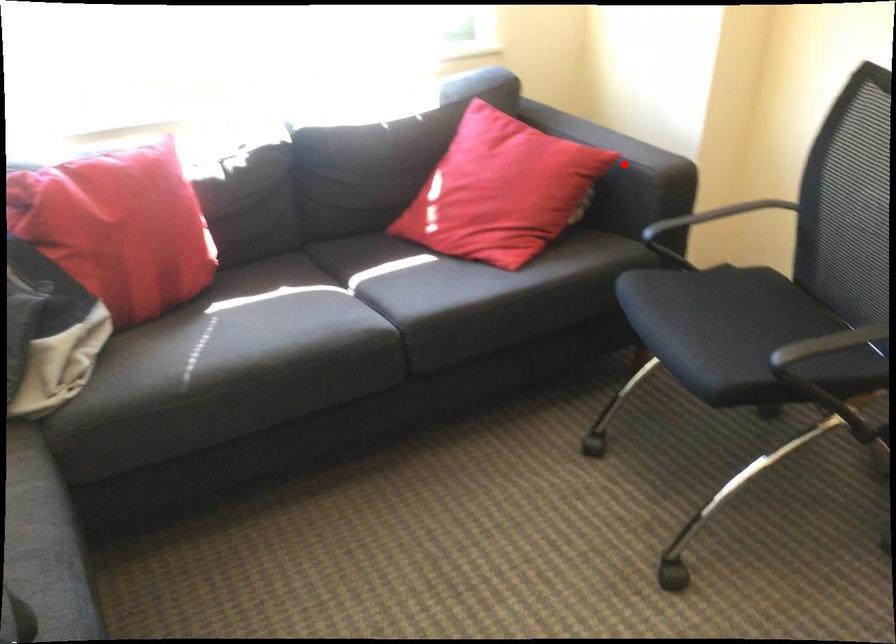
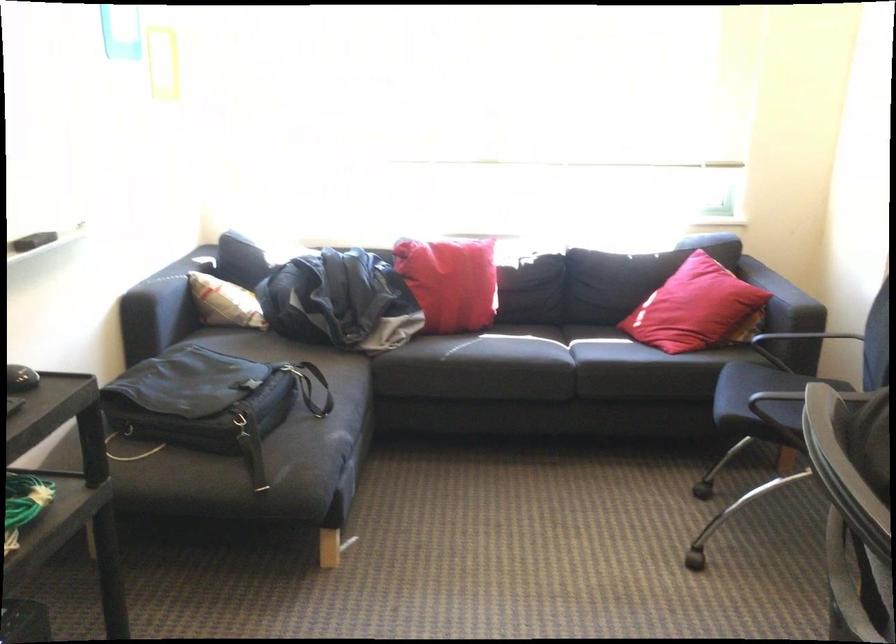
Find the pixel in the second image that matches the highlighted location in the first image.

(782, 298)